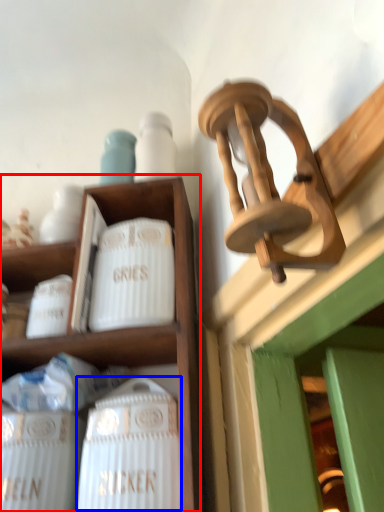
Question: Which point is further to the camera, shelf (highlighted by a red box) or wine bottle (highlighted by a blue box)?

Choices:
 (A) shelf
 (B) wine bottle

Answer: (A)